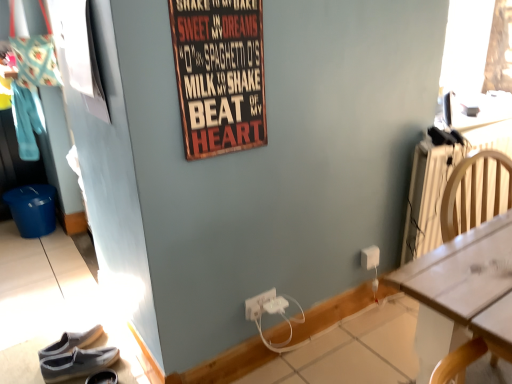
Question: From the image's perspective, relative to white plastic power outlet at lower right, marked as the third power outlet in a left-to-right arrangement, is white plastic power outlet at lower center, positioned as the second power outlet in left-to-right order, above or below?

Choices:
 (A) above
 (B) below

Answer: (B)

Question: In terms of width, does white plastic power outlet at lower center, positioned as the second power outlet in left-to-right order, look wider or thinner when compared to white plastic power outlet at lower right, acting as the first power outlet starting from the back?

Choices:
 (A) thin
 (B) wide

Answer: (B)

Question: Based on their relative distances, which object is nearer to the white plastic power outlet at lower center, the third power outlet in the back-to-front sequence?

Choices:
 (A) white wood desk at right
 (B) gray fabric shoe at lower left, the first footwear viewed from the right
 (C) dark gray canvas shoes at lower left, acting as the 2th footwear starting from the right
 (D) white plastic power outlet at lower center, placed as the second power outlet when sorted from front to back
 (E) wooden signboard at upper center

Answer: (D)

Question: Which object is the farthest from the white plastic power outlet at lower center, the first power outlet viewed from the left?

Choices:
 (A) white plastic power outlet at lower right, acting as the first power outlet starting from the back
 (B) wooden signboard at upper center
 (C) white wood desk at right
 (D) white plastic power outlet at lower center, the first power outlet when ordered from front to back
 (E) gray fabric shoe at lower left, the first footwear viewed from the right

Answer: (B)